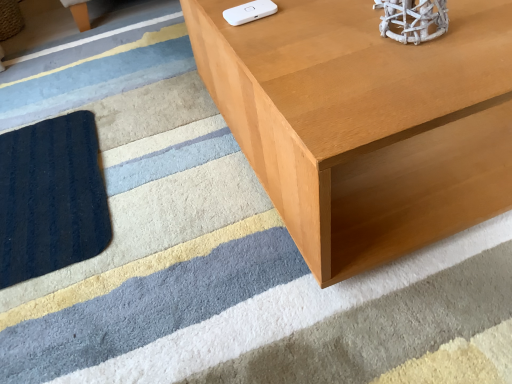
Locate an element on the screen. The width and height of the screenshot is (512, 384). white matte wii controller at upper center is located at coordinates (249, 12).

The height and width of the screenshot is (384, 512). Describe the element at coordinates (249, 12) in the screenshot. I see `white matte wii controller at upper center` at that location.

Locate an element on the screen. This screenshot has width=512, height=384. light brown wood table at upper right is located at coordinates (365, 123).

This screenshot has width=512, height=384. What do you see at coordinates (365, 123) in the screenshot?
I see `light brown wood table at upper right` at bounding box center [365, 123].

The height and width of the screenshot is (384, 512). I want to click on white matte wii controller at upper center, so click(x=249, y=12).

Which is more to the left, light brown wood table at upper right or white matte wii controller at upper center?

From the viewer's perspective, white matte wii controller at upper center appears more on the left side.

Which object is further away from the camera taking this photo, light brown wood table at upper right or white matte wii controller at upper center?

white matte wii controller at upper center is behind.

Does point (342, 176) appear closer or farther from the camera than point (240, 16)?

Point (342, 176) is farther from the camera than point (240, 16).

From the image's perspective, which is above, light brown wood table at upper right or white matte wii controller at upper center?

light brown wood table at upper right.

From a real-world perspective, who is located lower, light brown wood table at upper right or white matte wii controller at upper center?

light brown wood table at upper right, from a real-world perspective.

Is light brown wood table at upper right thinner than white matte wii controller at upper center?

Incorrect, the width of light brown wood table at upper right is not less than that of white matte wii controller at upper center.

Consider the image. Is light brown wood table at upper right shorter than white matte wii controller at upper center?

No.

Consider the image. Can you confirm if light brown wood table at upper right is bigger than white matte wii controller at upper center?

Yes.

Is light brown wood table at upper right located outside white matte wii controller at upper center?

Indeed, light brown wood table at upper right is completely outside white matte wii controller at upper center.

Are light brown wood table at upper right and white matte wii controller at upper center far apart?

No, there isn't a large distance between light brown wood table at upper right and white matte wii controller at upper center.

Is light brown wood table at upper right facing away from white matte wii controller at upper center?

No, white matte wii controller at upper center is not at the back of light brown wood table at upper right.

I want to click on table in front of the white matte wii controller at upper center, so click(365, 123).

Is white matte wii controller at upper center to the left or to the right of light brown wood table at upper right in the image?

In the image, white matte wii controller at upper center appears on the left side of light brown wood table at upper right.

Who is more distant, white matte wii controller at upper center or light brown wood table at upper right?

white matte wii controller at upper center is further away from the camera.

Does point (229, 9) appear closer or farther from the camera than point (231, 86)?

Point (229, 9) appears to be closer to the viewer than point (231, 86).

From the image's perspective, between white matte wii controller at upper center and light brown wood table at upper right, which one is located above?

light brown wood table at upper right is shown above in the image.

From a real-world perspective, is white matte wii controller at upper center physically above light brown wood table at upper right?

Yes, from a real-world perspective, white matte wii controller at upper center is above light brown wood table at upper right.

Is white matte wii controller at upper center thinner than light brown wood table at upper right?

Yes, white matte wii controller at upper center is thinner than light brown wood table at upper right.

Can you confirm if white matte wii controller at upper center is taller than light brown wood table at upper right?

No.

Considering the relative sizes of white matte wii controller at upper center and light brown wood table at upper right in the image provided, is white matte wii controller at upper center bigger than light brown wood table at upper right?

Incorrect, white matte wii controller at upper center is not larger than light brown wood table at upper right.

Do you think white matte wii controller at upper center is within light brown wood table at upper right, or outside of it?

white matte wii controller at upper center exists outside the volume of light brown wood table at upper right.

Is white matte wii controller at upper center not near light brown wood table at upper right?

No, white matte wii controller at upper center is not far away from light brown wood table at upper right.

Could you tell me if white matte wii controller at upper center is facing light brown wood table at upper right?

No, white matte wii controller at upper center is not turned towards light brown wood table at upper right.

Can you tell me how much white matte wii controller at upper center and light brown wood table at upper right differ in facing direction?

There is a 4.65-degree angle between the facing directions of white matte wii controller at upper center and light brown wood table at upper right.

There is a light brown wood table at upper right. Where is `Wii controller above it (from a real-world perspective)`? The height and width of the screenshot is (384, 512). Wii controller above it (from a real-world perspective) is located at coordinates (249, 12).

Identify the location of Wii controller below the light brown wood table at upper right (from the image's perspective). (249, 12).

Find the location of a particular element. table in front of the white matte wii controller at upper center is located at coordinates (365, 123).